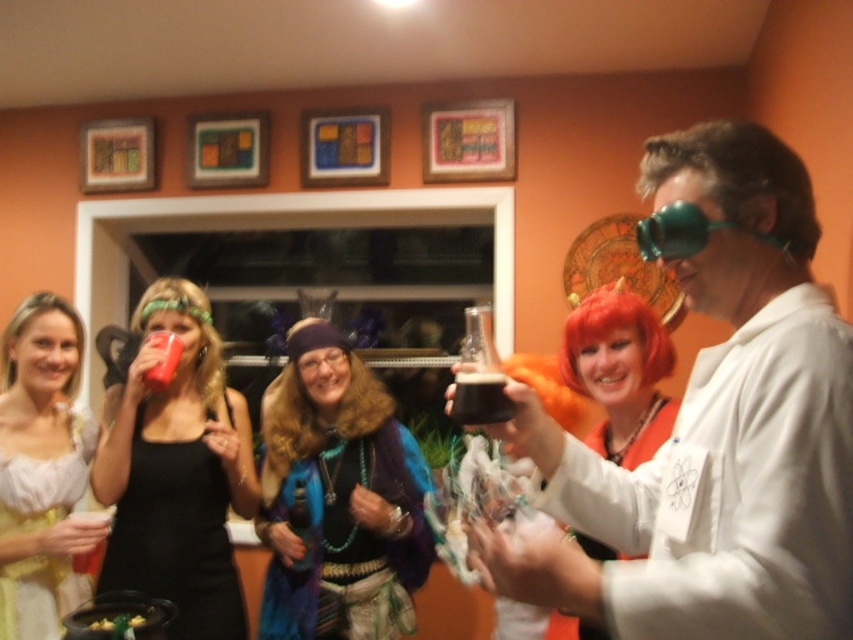
Question: Is blue fuzzy wig at center smaller than blonde synthetic wig at left?

Choices:
 (A) no
 (B) yes

Answer: (A)

Question: Which point appears farthest from the camera in this image?

Choices:
 (A) (676, 252)
 (B) (640, 400)

Answer: (B)

Question: Is shiny blue fabric at center closer to camera compared to red synthetic wig at upper right?

Choices:
 (A) yes
 (B) no

Answer: (B)

Question: Which point appears farthest from the camera in this image?

Choices:
 (A) (33, 314)
 (B) (218, 422)
 (C) (73, 440)
 (D) (781, 630)

Answer: (B)

Question: Which point is closer to the camera?

Choices:
 (A) (648, 385)
 (B) (7, 579)
 (C) (192, 365)
 (D) (474, 401)

Answer: (D)

Question: Does blue fuzzy wig at center have a larger size compared to red synthetic wig at upper right?

Choices:
 (A) no
 (B) yes

Answer: (B)